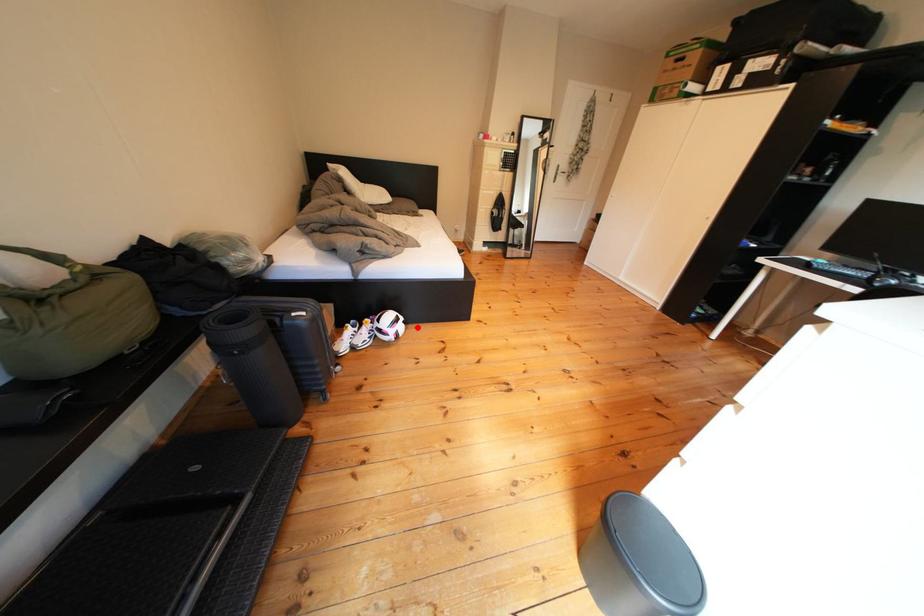
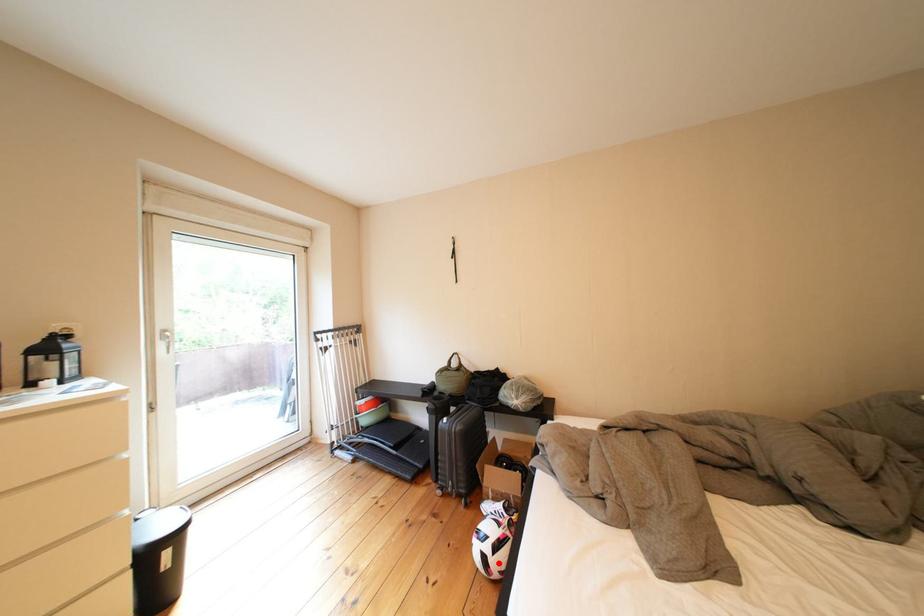
I am providing you with two images of the same scene from different viewpoints. A red point is marked on the first image and another point is marked on the second image. Is the red point in image1 aligned with the point shown in image2?

Yes